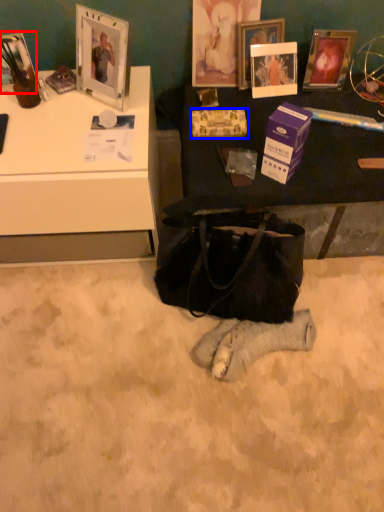
Question: Which point is further to the camera, picture frame (highlighted by a red box) or paperback book (highlighted by a blue box)?

Choices:
 (A) picture frame
 (B) paperback book

Answer: (B)